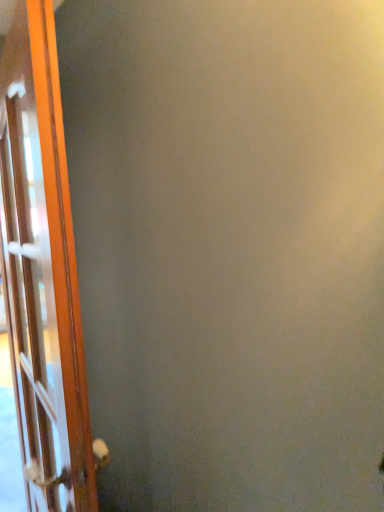
In order to face wooden door at left, should I rotate leftwards or rightwards?

You should look left and rotate roughly 23.807 degrees.

Identify the location of wooden door at left. (42, 268).

The image size is (384, 512). What do you see at coordinates (42, 268) in the screenshot?
I see `wooden door at left` at bounding box center [42, 268].

You are a GUI agent. You are given a task and a screenshot of the screen. Output one action in this format:
    pyautogui.click(x=<x>, y=<y>)
    Task: Click on the wooden door at left
    This screenshot has height=512, width=384.
    Given the screenshot: What is the action you would take?
    pyautogui.click(x=42, y=268)